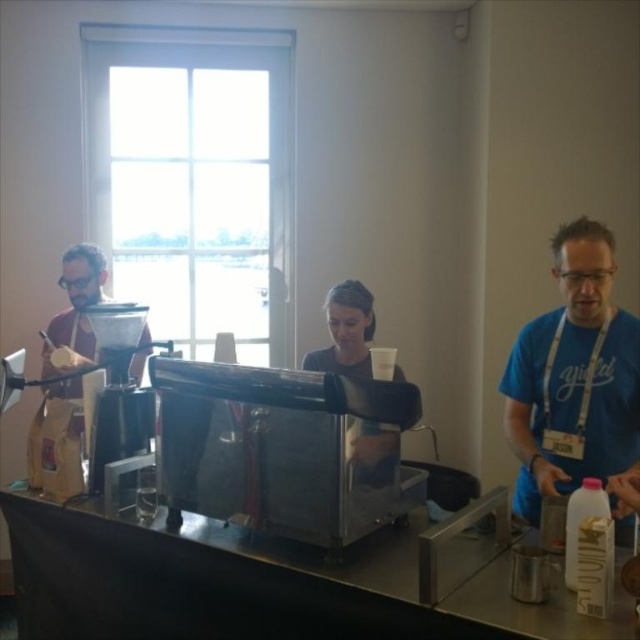
You are standing in front of the table and want to place a new coffee bean bag to the right of the metallic silver coffee machine at center. Is there enough space on the table for this placement?

The metallic silver coffee machine at center is located at point (118,388), so placing a new coffee bean bag to the right of it would depend on the table dimensions. However, since the table is described as having a dark cloth covering it with the coffee machine and existing bag to the left, there might be sufficient space to the right unless the table is fully occupied. The exact answer requires knowing the table size and existing items layout, which isn not provided. Thus, it cannot be determined with

You are standing in front of the coffee setup and notice two shirts hanging nearby. The blue cotton shirt at right and the dark gray shirt at center. Which shirt is closer to you?

The blue cotton shirt at right is closer to the viewer than the dark gray shirt at center.

You are a customer trying to order coffee from the barista wearing the blue cotton shirt at right. Where should you stand in relation to the metallic silver coffee machine at center to be seen by the barista?

You should stand to the left of the metallic silver coffee machine at center because the blue cotton shirt at right is positioned over the metallic silver coffee machine at center, indicating the barista is on the right side of the machine.